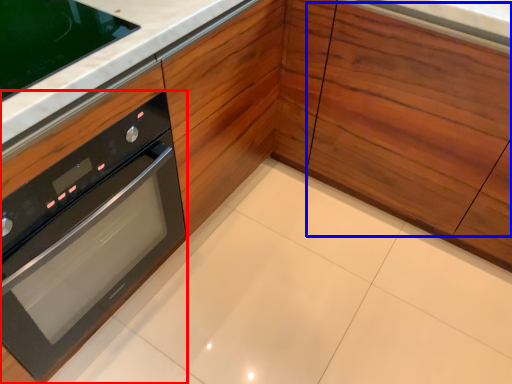
Question: Which object appears closest to the camera in this image, oven (highlighted by a red box) or drawer (highlighted by a blue box)?

Choices:
 (A) oven
 (B) drawer

Answer: (A)